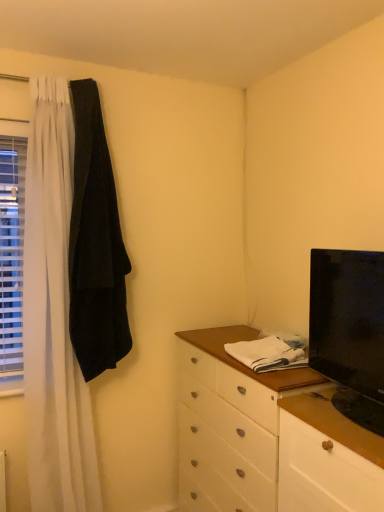
Question: Is there a large distance between black velvet robe at left and white plastic blinds at left?

Choices:
 (A) yes
 (B) no

Answer: (B)

Question: Can you see black velvet robe at left touching white plastic blinds at left?

Choices:
 (A) no
 (B) yes

Answer: (A)

Question: Is black velvet robe at left shorter than white plastic blinds at left?

Choices:
 (A) no
 (B) yes

Answer: (A)

Question: From the image's perspective, would you say black velvet robe at left is positioned over white plastic blinds at left?

Choices:
 (A) yes
 (B) no

Answer: (A)

Question: Is black velvet robe at left closer to the viewer compared to white plastic blinds at left?

Choices:
 (A) yes
 (B) no

Answer: (A)

Question: Is black velvet robe at left bigger than white plastic blinds at left?

Choices:
 (A) no
 (B) yes

Answer: (B)

Question: Can you confirm if white wood counter top at center is bigger than black velvet robe at left?

Choices:
 (A) yes
 (B) no

Answer: (B)

Question: From a real-world perspective, is white wood counter top at center physically below black velvet robe at left?

Choices:
 (A) no
 (B) yes

Answer: (B)

Question: Is white wood counter top at center closer to camera compared to black velvet robe at left?

Choices:
 (A) yes
 (B) no

Answer: (A)

Question: Is white wood counter top at center outside black velvet robe at left?

Choices:
 (A) no
 (B) yes

Answer: (B)

Question: Is white wood counter top at center positioned with its back to black velvet robe at left?

Choices:
 (A) no
 (B) yes

Answer: (A)

Question: Does white wood counter top at center lie behind black velvet robe at left?

Choices:
 (A) yes
 (B) no

Answer: (B)

Question: Can you confirm if black glossy tv at right is thinner than white plastic blinds at left?

Choices:
 (A) yes
 (B) no

Answer: (B)